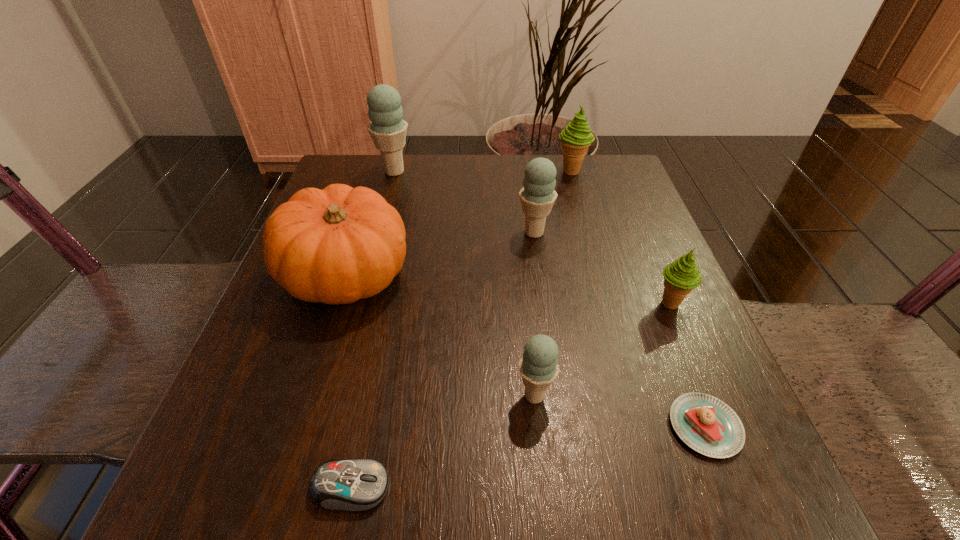
Where is `the leftmost ice cream`? Image resolution: width=960 pixels, height=540 pixels. the leftmost ice cream is located at coordinates (388, 130).

Where is `the farthest blue ice cream`? This screenshot has width=960, height=540. the farthest blue ice cream is located at coordinates (388, 130).

This screenshot has height=540, width=960. In order to click on the farther green icecream in this screenshot , I will do `click(576, 138)`.

What are the coordinates of `the bigger green icecream` in the screenshot? It's located at (576, 138).

At what (x,y) coordinates should I click in order to perform the action: click on the second smallest blue ice cream. Please return your answer as a coordinate pair (x, y). Looking at the image, I should click on click(x=537, y=196).

Identify the location of the third nearest ice cream. (537, 196).

Where is `pumpkin`? The image size is (960, 540). pumpkin is located at coordinates (337, 245).

Where is `the smaller green icecream`? The image size is (960, 540). the smaller green icecream is located at coordinates (681, 276).

Where is `the right green icecream`? the right green icecream is located at coordinates (681, 276).

This screenshot has width=960, height=540. Find the location of `the nearest blue ice cream`. the nearest blue ice cream is located at coordinates [x=538, y=366].